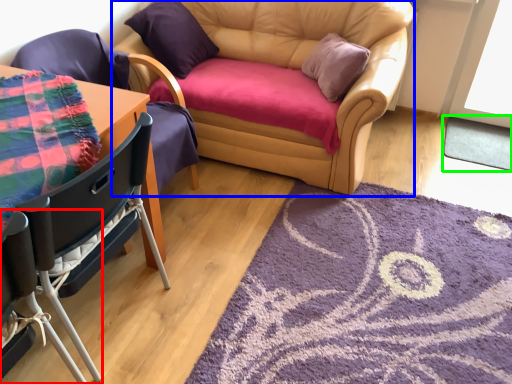
Question: Estimate the real-world distances between objects in this image. Which object is farther from chair (highlighted by a red box), studio couch (highlighted by a blue box) or mat (highlighted by a green box)?

Choices:
 (A) studio couch
 (B) mat

Answer: (B)